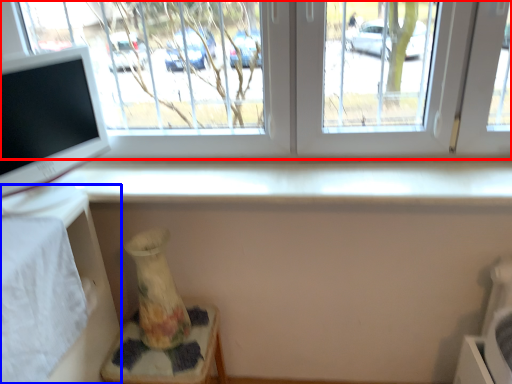
Question: Which object appears closest to the camera in this image, window (highlighted by a red box) or table (highlighted by a blue box)?

Choices:
 (A) window
 (B) table

Answer: (B)